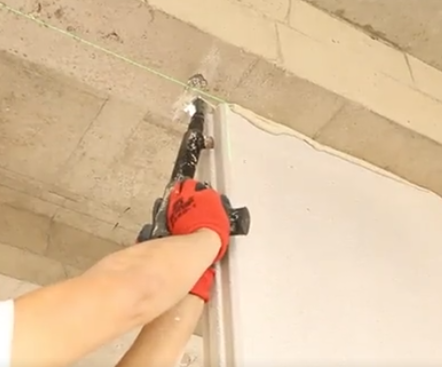
This screenshot has height=367, width=442. I want to click on caulking, so click(257, 119), click(290, 129), click(322, 146), click(361, 161).